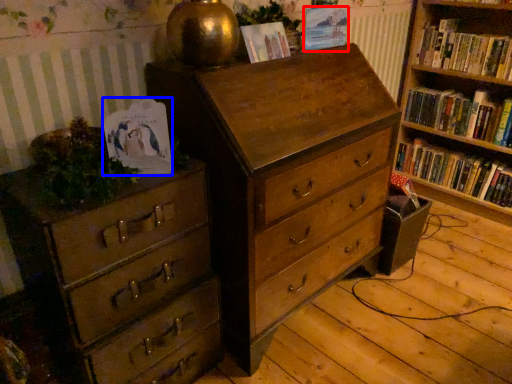
Question: Among these objects, which one is farthest to the camera, paperback book (highlighted by a red box) or paperback book (highlighted by a blue box)?

Choices:
 (A) paperback book
 (B) paperback book

Answer: (A)